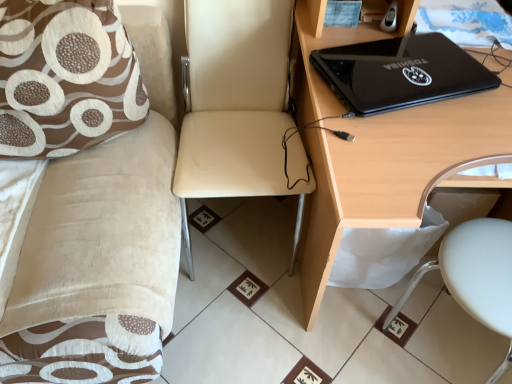
Question: Considering the relative sizes of black glossy laptop at upper right and beige leather chair at center in the image provided, is black glossy laptop at upper right shorter than beige leather chair at center?

Choices:
 (A) no
 (B) yes

Answer: (B)

Question: Considering the relative sizes of black glossy laptop at upper right and beige leather chair at center in the image provided, is black glossy laptop at upper right bigger than beige leather chair at center?

Choices:
 (A) no
 (B) yes

Answer: (A)

Question: Can you confirm if black glossy laptop at upper right is wider than beige leather chair at center?

Choices:
 (A) no
 (B) yes

Answer: (A)

Question: Is black glossy laptop at upper right outside of beige leather chair at center?

Choices:
 (A) no
 (B) yes

Answer: (B)

Question: Is black glossy laptop at upper right looking in the opposite direction of beige leather chair at center?

Choices:
 (A) no
 (B) yes

Answer: (A)

Question: From the image's perspective, would you say black glossy laptop at upper right is shown under beige leather chair at center?

Choices:
 (A) no
 (B) yes

Answer: (A)

Question: Is white plastic swivel chair at lower right at the right side of beige fabric couch at upper left?

Choices:
 (A) yes
 (B) no

Answer: (A)

Question: Is white plastic swivel chair at lower right beside beige fabric couch at upper left?

Choices:
 (A) yes
 (B) no

Answer: (B)

Question: Is white plastic swivel chair at lower right further to the viewer compared to beige fabric couch at upper left?

Choices:
 (A) no
 (B) yes

Answer: (B)

Question: Can you confirm if white plastic swivel chair at lower right is thinner than beige fabric couch at upper left?

Choices:
 (A) yes
 (B) no

Answer: (A)

Question: Is white plastic swivel chair at lower right wider than beige fabric couch at upper left?

Choices:
 (A) no
 (B) yes

Answer: (A)

Question: From a real-world perspective, is white plastic swivel chair at lower right physically below beige fabric couch at upper left?

Choices:
 (A) no
 (B) yes

Answer: (B)

Question: Considering the relative sizes of brown fabric pillow at left and beige leather chair at center in the image provided, is brown fabric pillow at left thinner than beige leather chair at center?

Choices:
 (A) yes
 (B) no

Answer: (A)